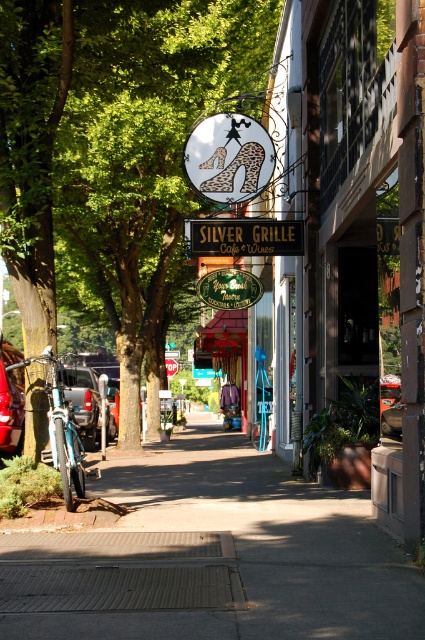
You are a pedestrian standing on the sidewalk in front of the Silver Grille. You notice a green leafy tree at center and a metallic silver car at left. Which object is casting a shadow over the other?

The green leafy tree at center is positioned over the metallic silver car at left, so its shadow is likely casting over the car.

You are a delivery person who needs to park your motorcycle between the concrete sidewalk at center and the matte silver suv at left. Can your motorcycle fit in the space between them?

The concrete sidewalk at center is shorter than the matte silver suv at left, so the space between them may be insufficient for your motorcycle to fit comfortably. It is recommended to look for another parking spot.

Looking at this image, you are a delivery person who needs to park your van between the matte silver suv at left and the metallic silver car at left. Is there enough space between them for your van?

The matte silver suv at left is positioned on the left side of metallic silver car at left, so there is no space between them for the van to park between.